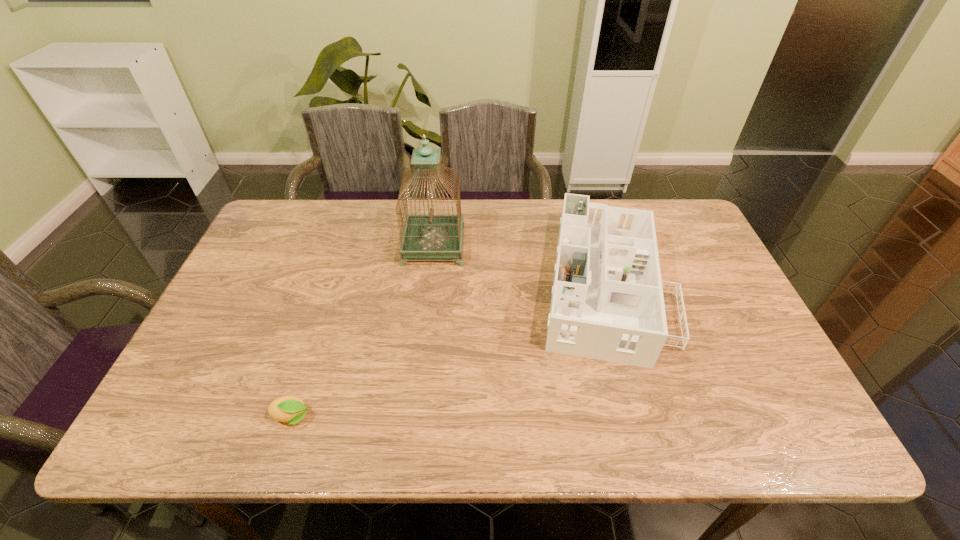
The width and height of the screenshot is (960, 540). Identify the location of dollhouse at the far edge. (607, 303).

Where is `object at the near edge`? Image resolution: width=960 pixels, height=540 pixels. object at the near edge is located at coordinates (291, 409).

Locate an element on the screen. vacant space at the far edge is located at coordinates (359, 220).

Where is `vacant space at the near edge of the desktop`? This screenshot has width=960, height=540. vacant space at the near edge of the desktop is located at coordinates (464, 440).

Find the location of a particular element. The height and width of the screenshot is (540, 960). vacant area at the left edge is located at coordinates (214, 350).

Locate an element on the screen. vacant space at the right edge is located at coordinates (690, 292).

Locate an element on the screen. The height and width of the screenshot is (540, 960). vacant space at the far left corner of the desktop is located at coordinates (288, 217).

This screenshot has height=540, width=960. I want to click on free space at the far right corner, so click(685, 207).

Locate an element on the screen. Image resolution: width=960 pixels, height=540 pixels. empty location between the nearest object and the second object from right to left is located at coordinates (363, 332).

Where is `unoccupied position between the tallest object and the lemon`? The width and height of the screenshot is (960, 540). unoccupied position between the tallest object and the lemon is located at coordinates (363, 332).